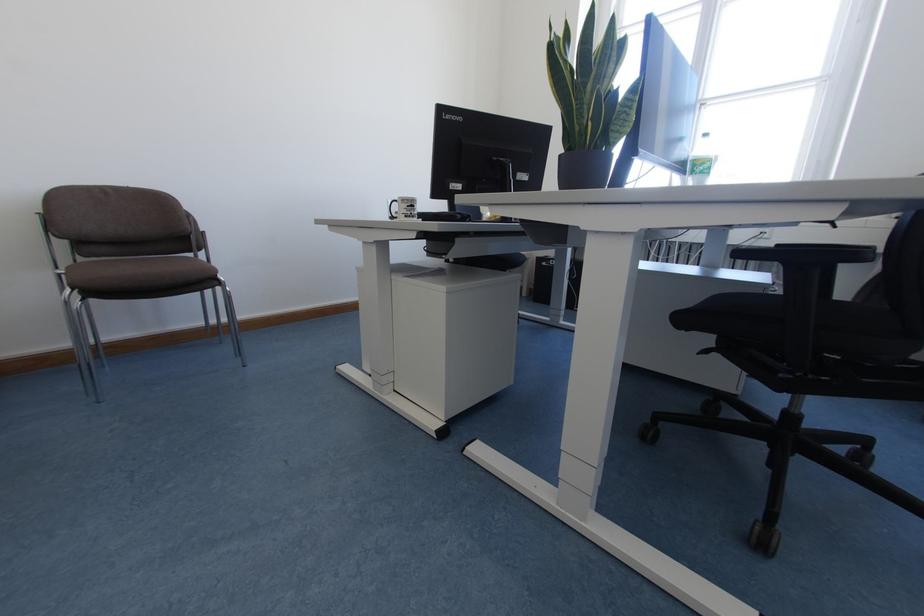
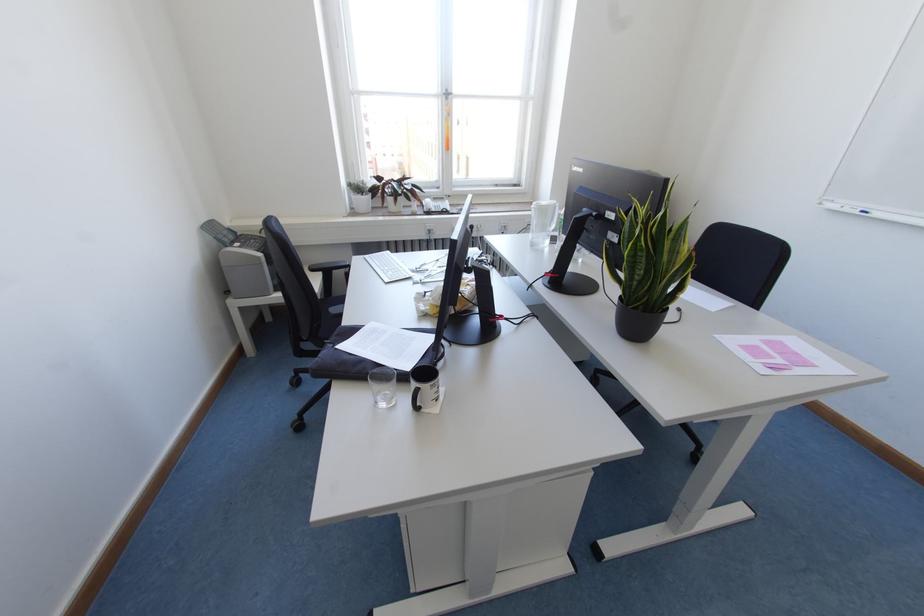
Where in the second image is the point corresponding to point 604,63 from the first image?

(677, 243)